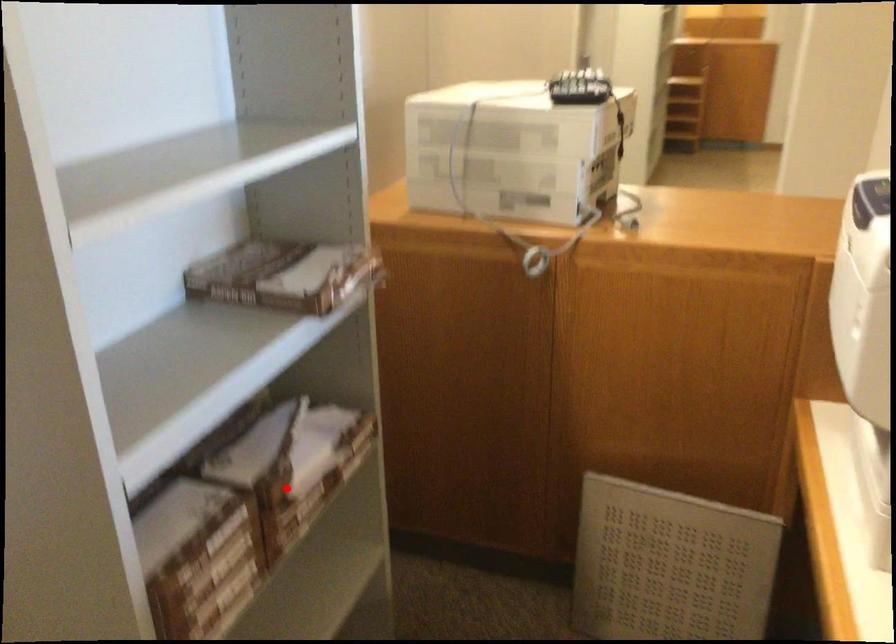
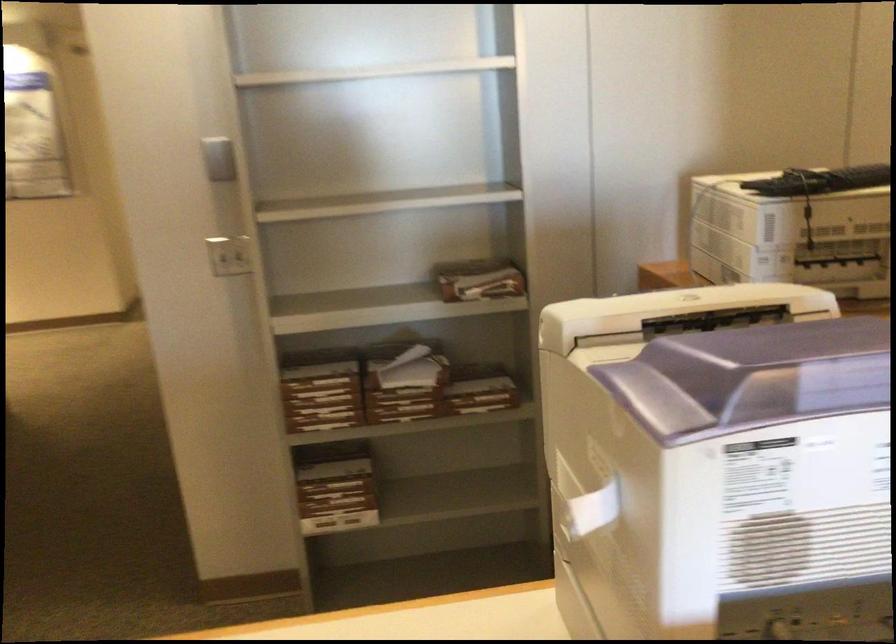
The point at the highlighted location is marked in the first image. Where is the corresponding point in the second image?

(398, 389)